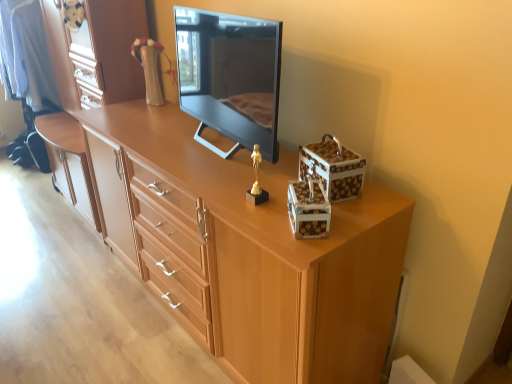
Question: Considering the positions of light wood chest of drawers at center and light brown wood dresser at center in the image, is light wood chest of drawers at center bigger or smaller than light brown wood dresser at center?

Choices:
 (A) small
 (B) big

Answer: (A)

Question: Considering the relative positions of light wood chest of drawers at center and light brown wood dresser at center in the image provided, is light wood chest of drawers at center to the left or to the right of light brown wood dresser at center?

Choices:
 (A) right
 (B) left

Answer: (A)

Question: Estimate the real-world distances between objects in this image. Which object is farther from the light brown wood dresser at center?

Choices:
 (A) black glossy television at center
 (B) white glossy storage box at upper right, placed as the 1th storage box when sorted from back to front
 (C) gold metallic statue at center
 (D) light wood chest of drawers at center
 (E) white glossy storage box at upper right, marked as the second storage box in a back-to-front arrangement

Answer: (E)

Question: Which object is positioned closest to the white glossy storage box at upper right, marked as the second storage box in a back-to-front arrangement?

Choices:
 (A) black glossy television at center
 (B) light brown wood dresser at center
 (C) gold metallic statue at center
 (D) light wood chest of drawers at center
 (E) white glossy storage box at upper right, placed as the 1th storage box when sorted from back to front

Answer: (E)